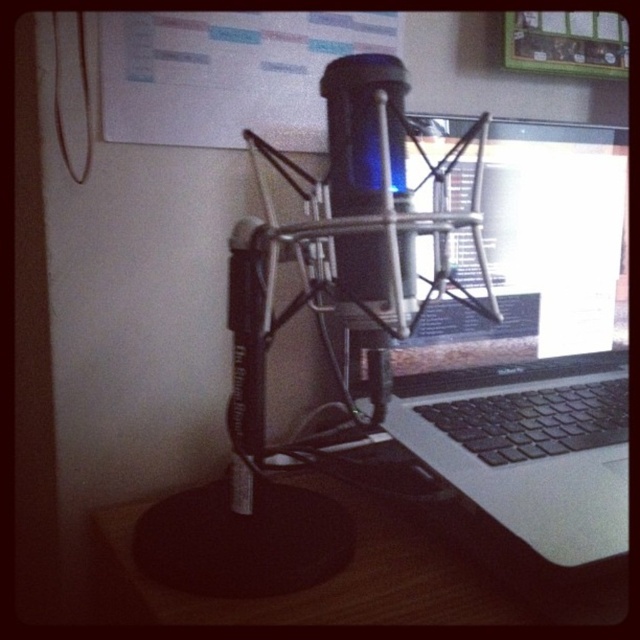
Question: Which point is farther from the camera taking this photo?

Choices:
 (A) (344, 173)
 (B) (163, 616)

Answer: (A)

Question: Which point appears farthest from the camera in this image?

Choices:
 (A) (419, 518)
 (B) (177, 80)
 (C) (413, 364)

Answer: (C)

Question: Observing the image, what is the correct spatial positioning of sleek silver laptop at center in reference to wooden table at center?

Choices:
 (A) left
 (B) right

Answer: (B)

Question: Is sleek silver laptop at center to the left of whiteboard at upper center from the viewer's perspective?

Choices:
 (A) yes
 (B) no

Answer: (B)

Question: Can you confirm if whiteboard at upper center is thinner than blue translucent microphone at center?

Choices:
 (A) yes
 (B) no

Answer: (B)

Question: Which of the following is the closest to the observer?

Choices:
 (A) (406, 556)
 (B) (458, 388)

Answer: (A)